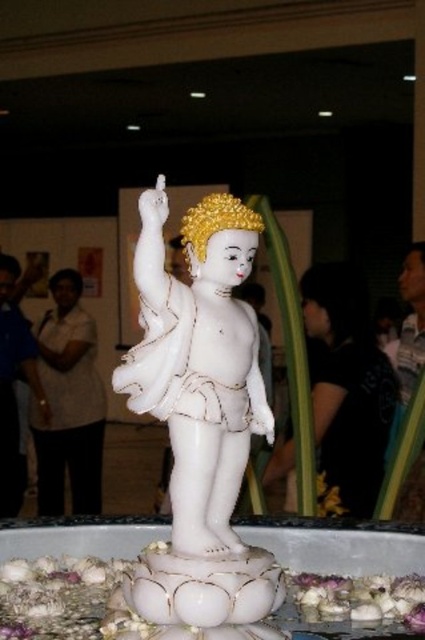
You are standing in a gallery and want to take a photo of the white marble statue at center. If you are positioned at the entrance of the gallery, which is at the bottom left corner of the room, in which direction should you point your camera to capture the statue?

The white marble statue at center is located at coordinates approximately 0.669 on the x axis and 0.468 on the y axis. Since you are at the bottom left corner, you should point your camera towards the upper right direction to capture the statue.

Looking at this image, you are an event organizer at the exhibition and need to adjust the lighting for the statue. The black fabric at center and purple fabric at lower right are part of the backdrop. Which fabric should you focus on first to ensure the statue remains the main focus, considering their positions?

The purple fabric at lower right is behind the black fabric at center, so you should focus on adjusting the lighting for the black fabric at center first to keep it in the foreground and maintain the statue as the main focus.

You are standing in front of the white marble statue of a child deity. There are two points marked on the statue. The first point is at coordinates point (317, 266) and the second is at point (73, 392). Which point is closer to you?

Point (317, 266) is closer to the viewer than point (73, 392).